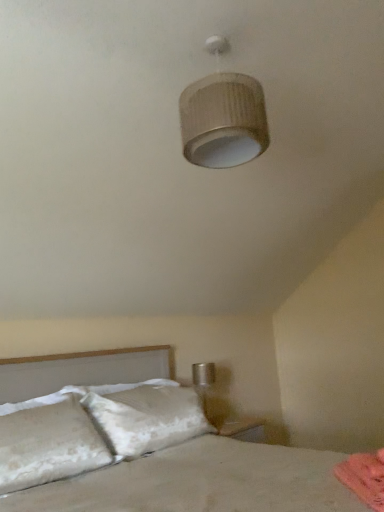
Question: Is white textured bed at lower left further to camera compared to matte beige lampshade at upper center?

Choices:
 (A) yes
 (B) no

Answer: (B)

Question: Is white textured bed at lower left beside matte beige lampshade at upper center?

Choices:
 (A) yes
 (B) no

Answer: (B)

Question: Is matte beige lampshade at upper center located within white textured bed at lower left?

Choices:
 (A) yes
 (B) no

Answer: (B)

Question: Is white textured bed at lower left bigger than matte beige lampshade at upper center?

Choices:
 (A) no
 (B) yes

Answer: (B)

Question: Does white textured bed at lower left have a smaller size compared to matte beige lampshade at upper center?

Choices:
 (A) yes
 (B) no

Answer: (B)

Question: Visually, is pink fabric at lower right positioned to the left or to the right of white textured bed at lower left?

Choices:
 (A) right
 (B) left

Answer: (A)

Question: Choose the correct answer: Is pink fabric at lower right inside white textured bed at lower left or outside it?

Choices:
 (A) outside
 (B) inside

Answer: (B)

Question: From a real-world perspective, is pink fabric at lower right physically located above or below white textured bed at lower left?

Choices:
 (A) above
 (B) below

Answer: (B)

Question: From the image's perspective, relative to white textured bed at lower left, is pink fabric at lower right above or below?

Choices:
 (A) below
 (B) above

Answer: (A)

Question: Do you think matte beige lampshade at upper center is within white textured bed at lower left, or outside of it?

Choices:
 (A) inside
 (B) outside

Answer: (B)

Question: Is matte beige lampshade at upper center to the left or to the right of white textured bed at lower left in the image?

Choices:
 (A) left
 (B) right

Answer: (B)

Question: Is matte beige lampshade at upper center wider or thinner than white textured bed at lower left?

Choices:
 (A) wide
 (B) thin

Answer: (B)

Question: Considering the positions of matte beige lampshade at upper center and white textured bed at lower left in the image, is matte beige lampshade at upper center taller or shorter than white textured bed at lower left?

Choices:
 (A) short
 (B) tall

Answer: (A)

Question: Does point (213, 452) appear closer or farther from the camera than point (354, 479)?

Choices:
 (A) farther
 (B) closer

Answer: (A)

Question: Based on their sizes in the image, would you say white textured bed at lower left is bigger or smaller than pink fabric at lower right?

Choices:
 (A) big
 (B) small

Answer: (A)